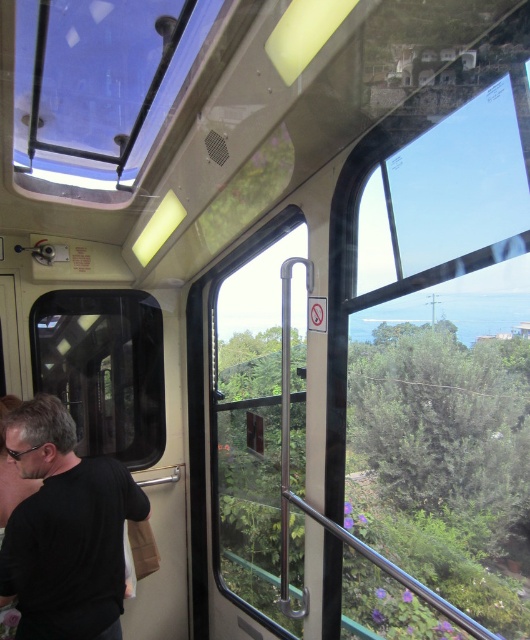
You are a passenger in the cable car and want to take a photo of the transparent glass window at upper right through your camera. The camera is 1.5 feet away from the window. Is the camera close enough to capture the window clearly?

The transparent glass window at upper right is 17.51 feet away from the camera. Since the camera is only 1.5 feet away from the window, it is much closer than the stated distance, so the camera is close enough to capture the window clearly.

You are a passenger in the cable car and want to take a photo of the view outside. You notice two windows available to lean against. Which window should you choose if you want to stand closer to the ceiling? Please select between the transparent glass window at upper right and the clear glass window at center.

The transparent glass window at upper right has a lesser height compared to the clear glass window at center. Therefore, you should choose the transparent glass window at upper right to stand closer to the ceiling since it is shorter and allows you to be nearer to the ceiling.